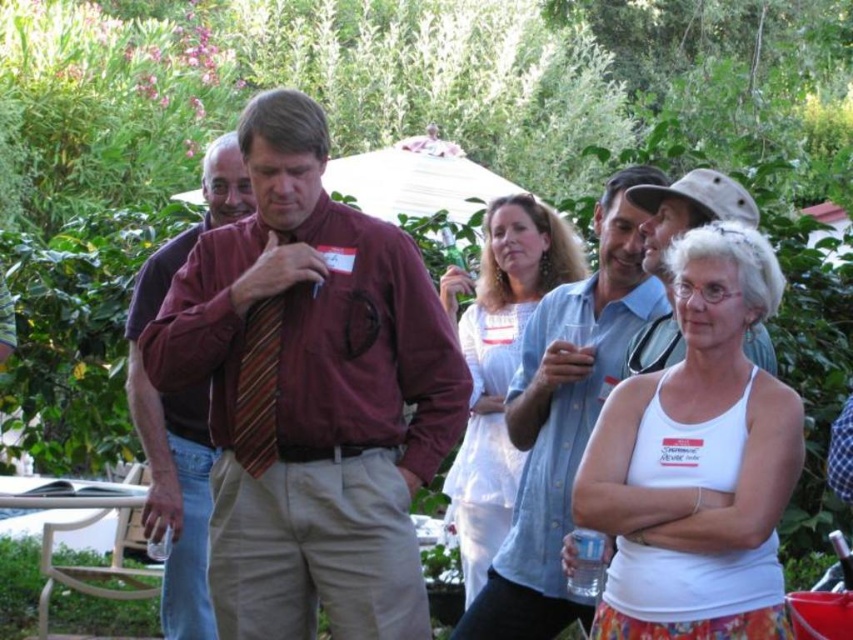
You are standing at the edge of the garden and want to greet the man wearing the maroon fabric shirt at center. If you walk directly towards him, how far will you have to walk to reach him?

The distance of maroon fabric shirt at center from camera is 5.50 meters, so you will have to walk 5.50 meters to reach him.

You are a photographer at the event and want to take a photo of the white tank top at center. Your camera is 15 feet away from the subject. Is the distance sufficient for a clear photo?

The white tank top at center and camera are 15.17 feet apart. Since the camera is 15 feet away, the distance is sufficient for a clear photo as it is within the required range.